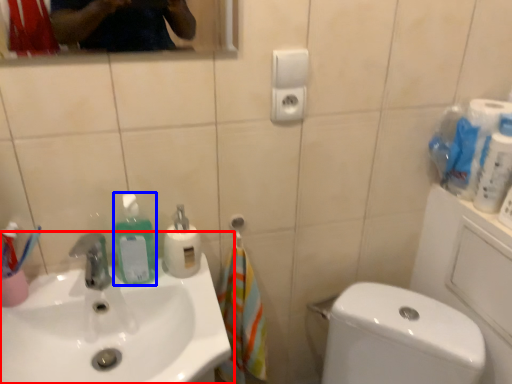
Question: Which object is closer to the camera taking this photo, sink (highlighted by a red box) or cleaning product (highlighted by a blue box)?

Choices:
 (A) sink
 (B) cleaning product

Answer: (A)